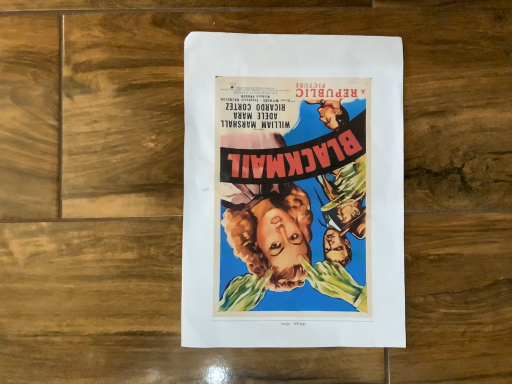
The image size is (512, 384). I want to click on empty space that is ontop of vibrant paper poster at center (from a real-world perspective), so click(296, 185).